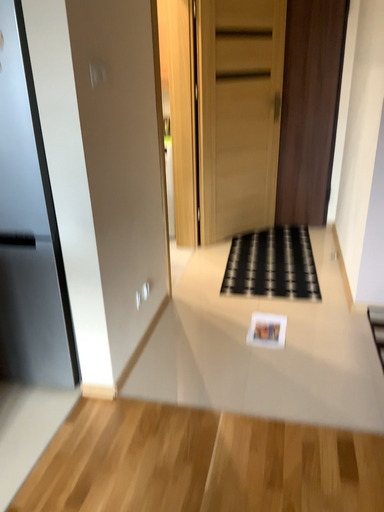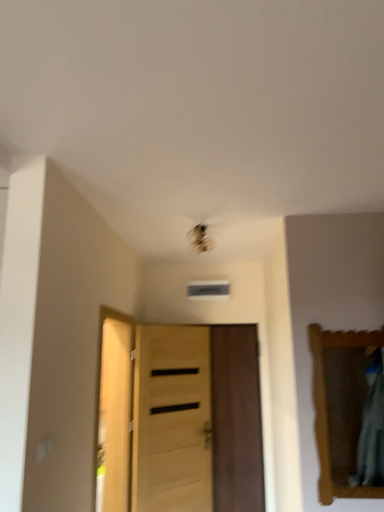
Question: Which way did the camera rotate in the video?

Choices:
 (A) rotated upward
 (B) rotated downward

Answer: (A)